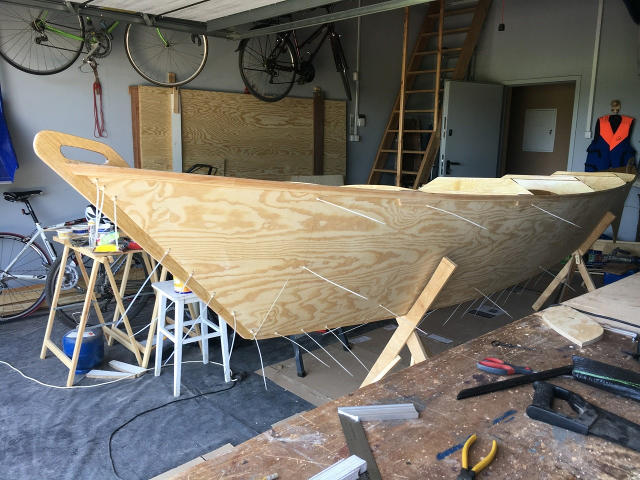
Where is `white stool`? Image resolution: width=640 pixels, height=480 pixels. white stool is located at coordinates (175, 309).